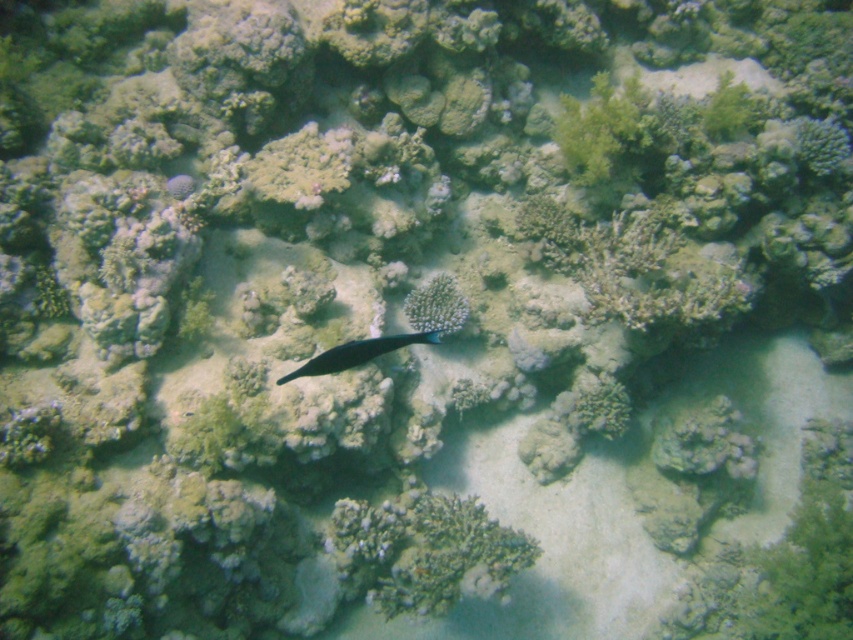
Question: Which point appears closest to the camera in this image?

Choices:
 (A) (424, 337)
 (B) (438, 314)

Answer: (A)

Question: Is white porous coral at center to the left of shiny blue fish at center from the viewer's perspective?

Choices:
 (A) yes
 (B) no

Answer: (B)

Question: Observing the image, what is the correct spatial positioning of white porous coral at center in reference to shiny blue fish at center?

Choices:
 (A) below
 (B) above

Answer: (B)

Question: Among these points, which one is farthest from the camera?

Choices:
 (A) (439, 312)
 (B) (370, 346)

Answer: (A)

Question: Is white porous coral at center to the left of shiny blue fish at center from the viewer's perspective?

Choices:
 (A) yes
 (B) no

Answer: (B)